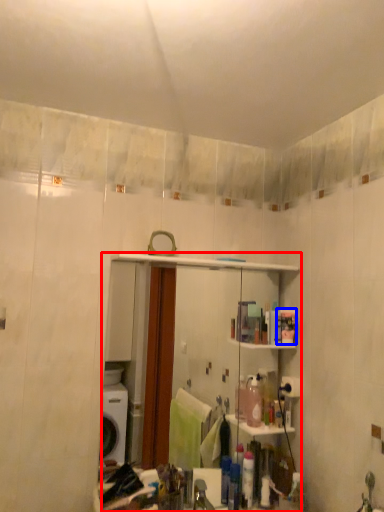
Question: Which object is further to the camera taking this photo, mirror (highlighted by a red box) or toiletry (highlighted by a blue box)?

Choices:
 (A) mirror
 (B) toiletry

Answer: (B)